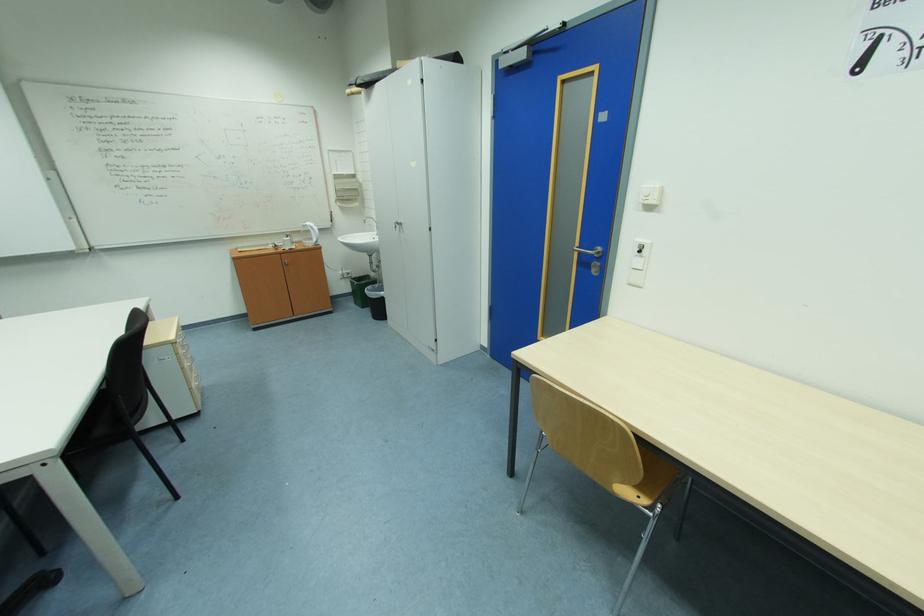
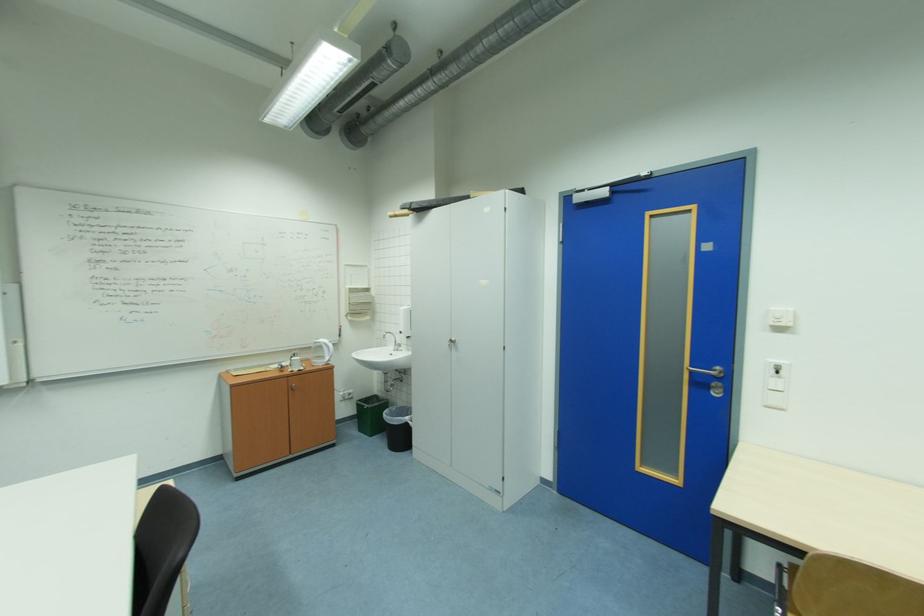
Question: In a continuous first-person perspective shot, in which direction is the camera moving?

Choices:
 (A) Left
 (B) Right
 (C) Forward
 (D) Backward

Answer: (A)